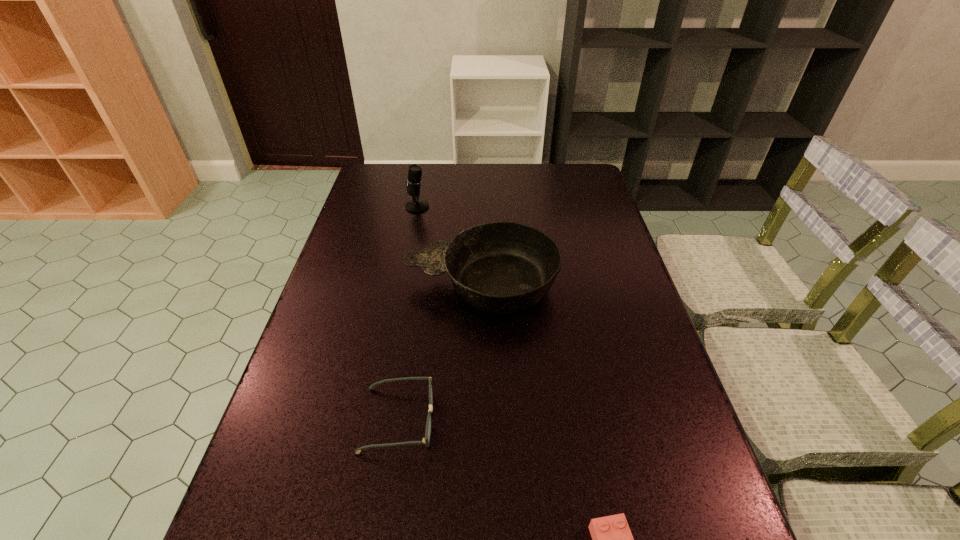
You are a GUI agent. You are given a task and a screenshot of the screen. Output one action in this format:
    pyautogui.click(x=<x>, y=<y>)
    Task: Click on the farthest object
    This screenshot has height=540, width=960.
    Given the screenshot: What is the action you would take?
    pyautogui.click(x=416, y=205)

At what (x,y) coordinates should I click in order to perform the action: click on microphone. Please return your answer as a coordinate pair (x, y). The width and height of the screenshot is (960, 540). Looking at the image, I should click on (416, 205).

Locate an element on the screen. frying pan is located at coordinates (503, 267).

The image size is (960, 540). I want to click on the third nearest object, so click(503, 267).

Identify the location of the second shortest object. (426, 440).

The image size is (960, 540). In order to click on the third farthest object in this screenshot , I will do `click(426, 440)`.

Where is `vacant space positioned 0.210m on the front of the tallest object`? vacant space positioned 0.210m on the front of the tallest object is located at coordinates (409, 251).

Locate an element on the screen. The width and height of the screenshot is (960, 540). free space located with the handle extending from the side of the second tallest object is located at coordinates (364, 284).

I want to click on vacant area situated 0.070m with the handle extending from the side of the second tallest object, so click(x=381, y=284).

The image size is (960, 540). In order to click on vacant space located with the handle extending from the side of the second tallest object in this screenshot , I will do `click(339, 284)`.